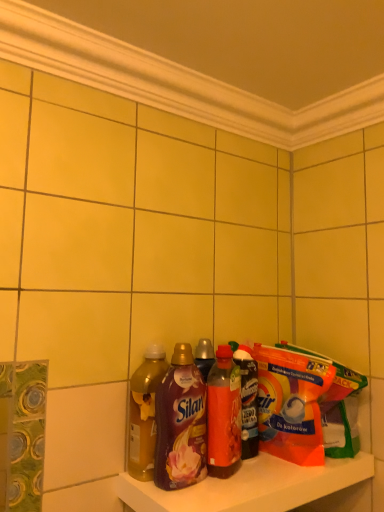
This screenshot has width=384, height=512. Find the location of `empty space that is ontop of translucent plastic bottles at lower center (from a real-world perspective)`. empty space that is ontop of translucent plastic bottles at lower center (from a real-world perspective) is located at coordinates (260, 472).